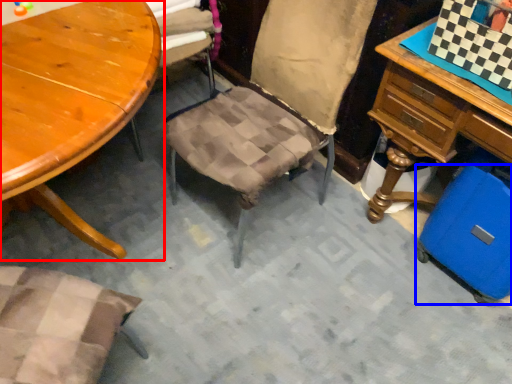
Question: Which object appears closest to the camera in this image, table (highlighted by a red box) or luggage (highlighted by a blue box)?

Choices:
 (A) table
 (B) luggage

Answer: (A)